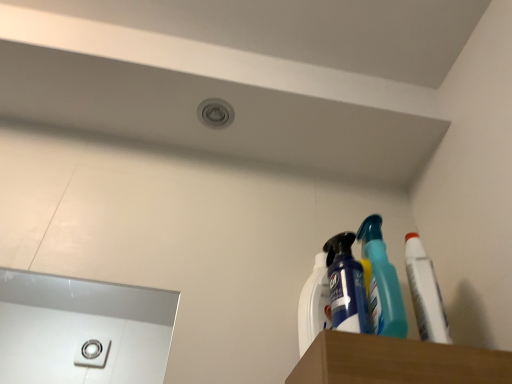
Question: Looking at their shapes, would you say white matte toothpaste at right is wider or thinner than white plastic spray bottle at upper right, which is the first cleaning product from left to right?

Choices:
 (A) wide
 (B) thin

Answer: (A)

Question: Is point (437, 342) positioned closer to the camera than point (326, 266)?

Choices:
 (A) closer
 (B) farther

Answer: (A)

Question: Based on their relative distances, which object is nearer to the blue glossy spray bottle at upper right, the 2th cleaning product viewed from the left?

Choices:
 (A) white matte toothpaste at right
 (B) white plastic spray bottle at upper right, which appears as the 2th cleaning product when viewed from the right

Answer: (B)

Question: Which object is the closest to the white matte toothpaste at right?

Choices:
 (A) blue glossy spray bottle at upper right, the 2th cleaning product viewed from the left
 (B) white plastic spray bottle at upper right, which is the first cleaning product from left to right

Answer: (A)